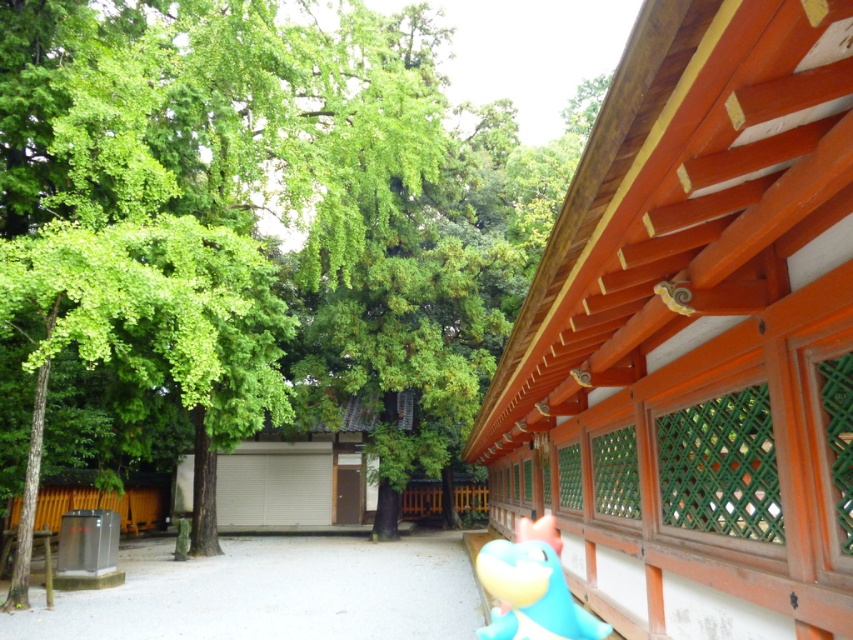
Question: Can you confirm if green leafy tree at upper left is wider than teal rubber toy at lower right?

Choices:
 (A) no
 (B) yes

Answer: (B)

Question: Does green leafy tree at upper left have a greater width compared to teal rubber toy at lower right?

Choices:
 (A) no
 (B) yes

Answer: (B)

Question: Is green leafy tree at upper left to the right of teal rubber toy at lower right from the viewer's perspective?

Choices:
 (A) yes
 (B) no

Answer: (B)

Question: Which point is closer to the camera?

Choices:
 (A) green leafy tree at upper left
 (B) teal rubber toy at lower right

Answer: (B)